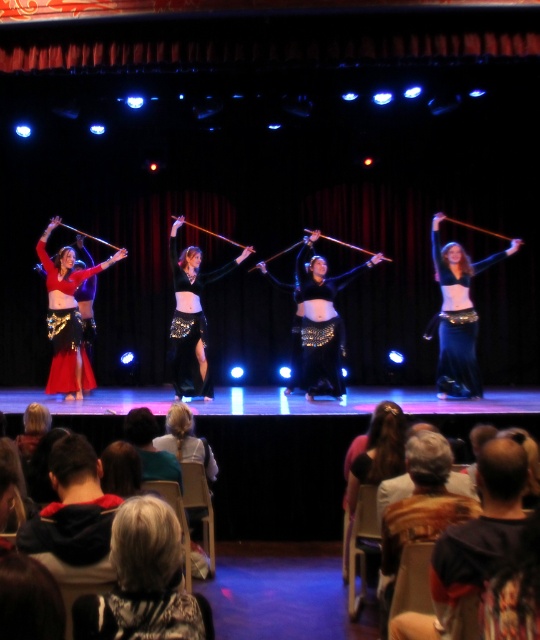
You are a photographer at the back of the stage. You want to take a photo of the black sequined belly dancer at center without the shiny red fabric at left blocking her face. Is this possible?

The shiny red fabric at left is positioned over the black sequined belly dancer at center, so it will block her face. Move to a different angle where the fabric is not in front of her.

You are a stagehand who needs to place a 5 meter long decorative banner between the black sequined belly dancer at center and the dark brown hair at lower center. Can you fit the banner between them?

The distance between the black sequined belly dancer at center and the dark brown hair at lower center is 4.38 meters, so the 5 meter banner is too long to fit between them.

You are a photographer at the back of the stage. You need to capture a photo of both the black sequined belly dancer at center and the dark brown hair at lower center. Based on their heights, which one might appear larger in the photo?

The black sequined belly dancer at center is taller than dark brown hair at lower center, so it will appear larger in the photo.